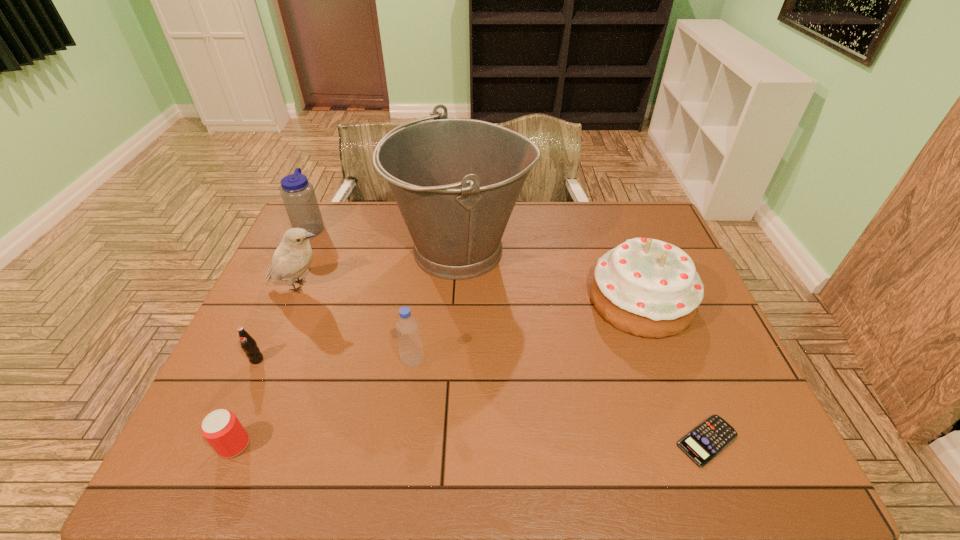
Where is `bird present at the left edge`? Image resolution: width=960 pixels, height=540 pixels. bird present at the left edge is located at coordinates (293, 256).

I want to click on water bottle that is at the left edge, so click(x=298, y=195).

Where is `pop situated at the left edge`? The image size is (960, 540). pop situated at the left edge is located at coordinates (248, 344).

This screenshot has width=960, height=540. I want to click on beer can that is at the left edge, so tap(221, 428).

This screenshot has height=540, width=960. In order to click on cake located in the right edge section of the desktop in this screenshot , I will do `click(645, 287)`.

Identify the location of calculator located in the right edge section of the desktop. The height and width of the screenshot is (540, 960). (703, 443).

Where is `object positioned at the far left corner`? The image size is (960, 540). object positioned at the far left corner is located at coordinates (298, 195).

Where is `object present at the near left corner`? The height and width of the screenshot is (540, 960). object present at the near left corner is located at coordinates (221, 428).

The height and width of the screenshot is (540, 960). What are the coordinates of `object that is at the near right corner` in the screenshot? It's located at (703, 443).

Locate an element on the screen. This screenshot has height=540, width=960. vacant space at the near edge is located at coordinates (708, 467).